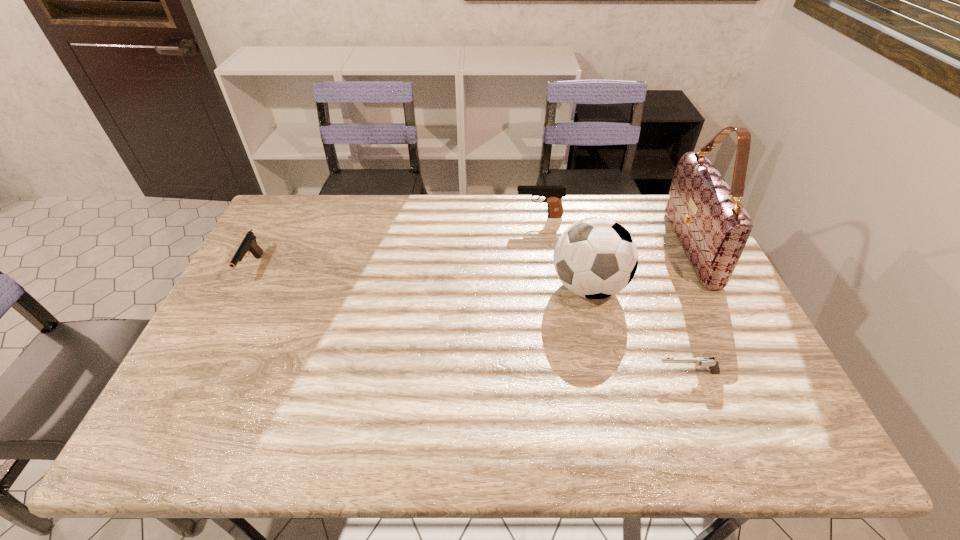
Identify which object is the third closest to the second nearest pistol. Please provide its 2D coordinates. Your answer should be formatted as a tuple, i.e. [(x, y)], where the tuple contains the x and y coordinates of a point satisfying the conditions above.

[(713, 365)]

Select which object appears as the second closest to the tallest pistol. Please provide its 2D coordinates. Your answer should be formatted as a tuple, i.e. [(x, y)], where the tuple contains the x and y coordinates of a point satisfying the conditions above.

[(713, 227)]

Find the location of a particular element. This screenshot has height=540, width=960. the closest pistol to the leftmost object is located at coordinates (553, 194).

What are the coordinates of `the closest pistol to the second tallest pistol` in the screenshot? It's located at (553, 194).

The image size is (960, 540). Identify the location of vacant region that satisfies the following two spatial constraints: 1. at the barrel of the second pistol from right to left; 2. at the muzzle of the second tallest pistol. 547,268.

Where is `free location that satisfies the following two spatial constraints: 1. at the barrel of the third tallest object; 2. at the muzzle of the fourth tallest object`? free location that satisfies the following two spatial constraints: 1. at the barrel of the third tallest object; 2. at the muzzle of the fourth tallest object is located at coordinates tap(547, 268).

Identify the location of vacant space that satisfies the following two spatial constraints: 1. on the front of the rightmost object with the clasp; 2. at the muzzle of the second shortest object. The height and width of the screenshot is (540, 960). (701, 268).